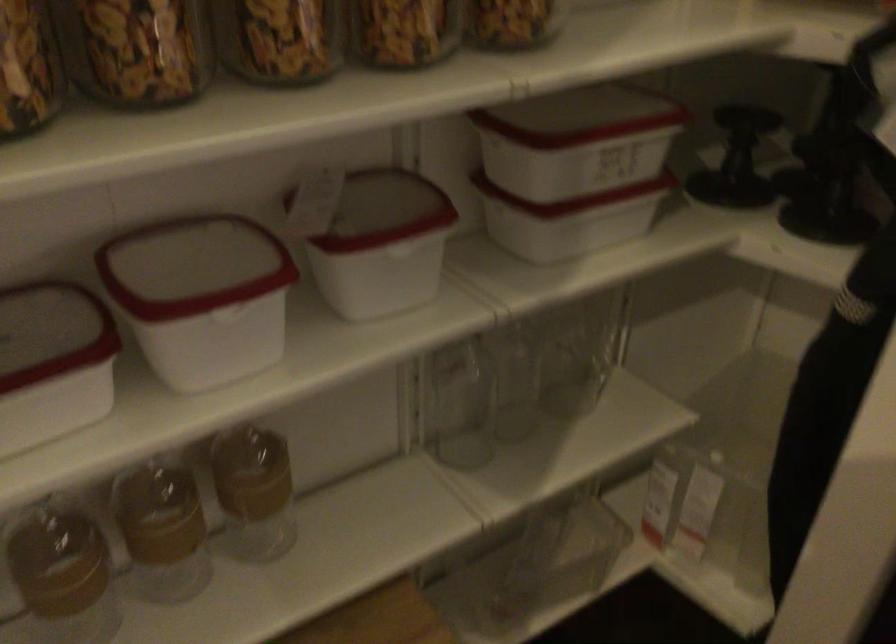
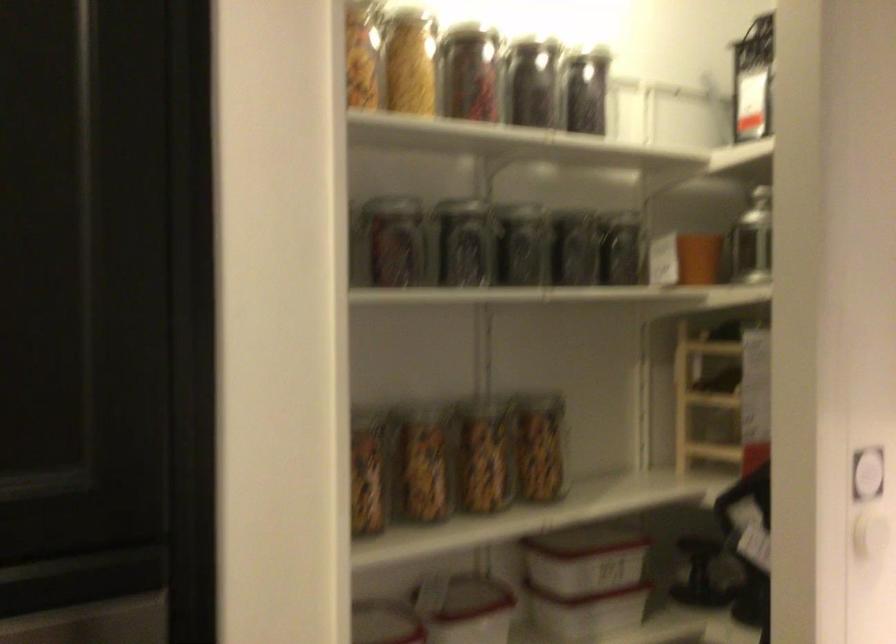
In the second image, find the point that corresponds to the point at 599,223 in the first image.

(607, 614)